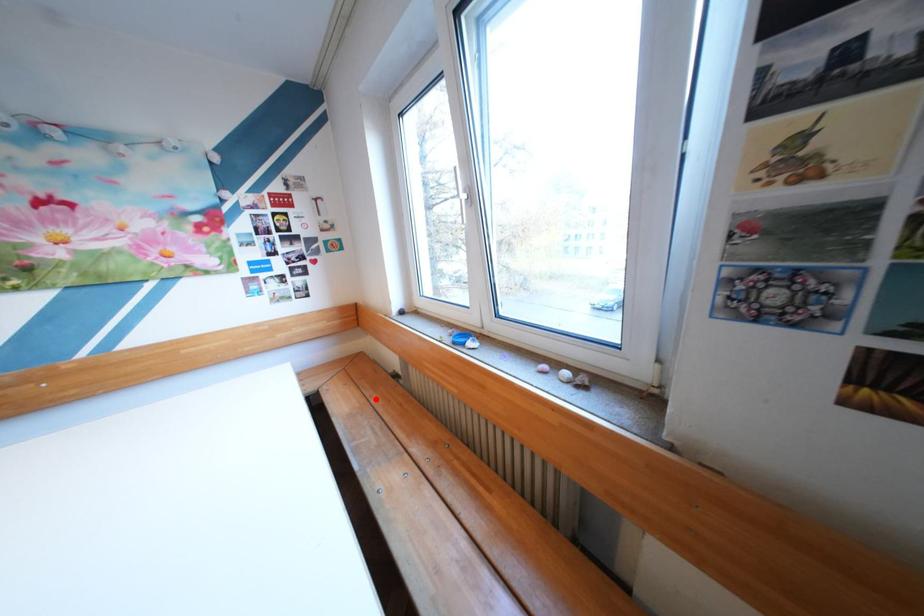
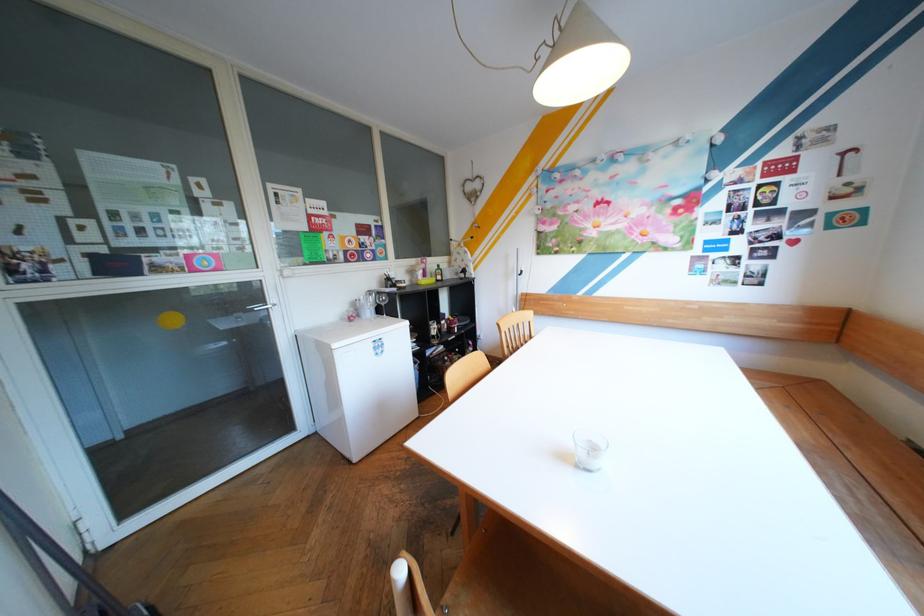
Where in the second image is the point corresponding to the highlighted location from the first image?

(840, 440)